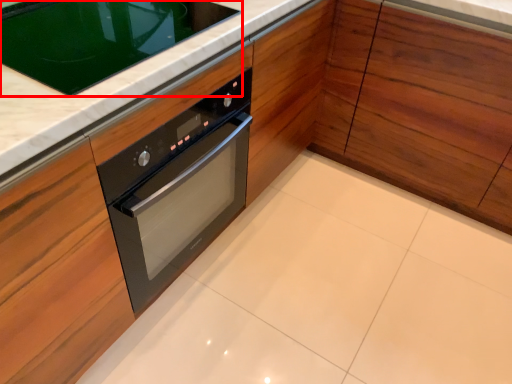
Question: From the image's perspective, what is the correct spatial relationship of home appliance (annotated by the red box) in relation to cabinetry?

Choices:
 (A) below
 (B) above

Answer: (A)